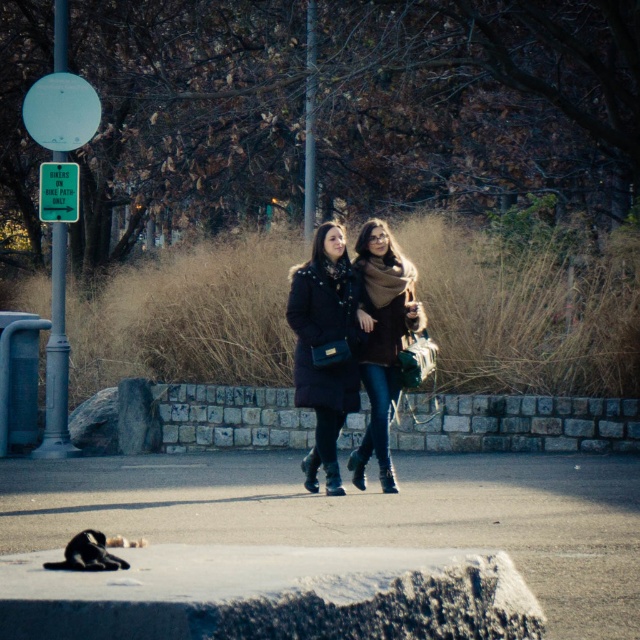
Question: Which of the following is the farthest from the observer?

Choices:
 (A) (369, 246)
 (B) (336, 492)
 (C) (577, 636)

Answer: (B)

Question: Which of the following is the closest to the observer?

Choices:
 (A) (371, 333)
 (B) (448, 493)

Answer: (B)

Question: Can you confirm if matte black coat at center is thinner than brown woolen scarf at center?

Choices:
 (A) no
 (B) yes

Answer: (A)

Question: Estimate the real-world distances between objects in this image. Which object is closer to the brown woolen scarf at center?

Choices:
 (A) concrete at center
 (B) matte black coat at center

Answer: (B)

Question: Can you confirm if matte black coat at center is bigger than brown woolen scarf at center?

Choices:
 (A) no
 (B) yes

Answer: (B)

Question: Is concrete at center below matte black coat at center?

Choices:
 (A) yes
 (B) no

Answer: (A)